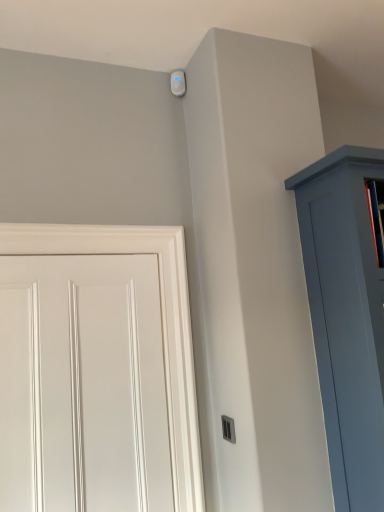
Measure the distance between point (137, 230) and camera.

Point (137, 230) and camera are 5.83 feet apart.

Describe the element at coordinates (161, 325) in the screenshot. This screenshot has height=512, width=384. I see `white matte door at left` at that location.

Locate an element on the screen. The width and height of the screenshot is (384, 512). white matte door at left is located at coordinates (161, 325).

Where is `white matte door at left`? The height and width of the screenshot is (512, 384). white matte door at left is located at coordinates (161, 325).